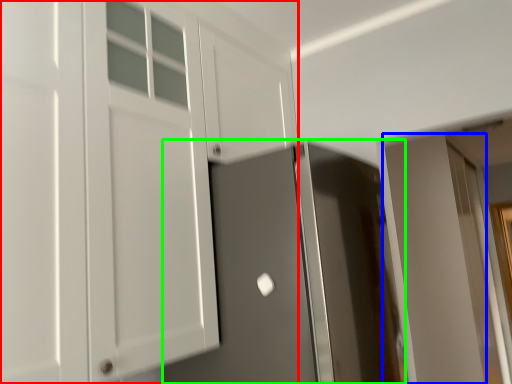
Question: Which object is the farthest from cabinetry (highlighted by a red box)? Choose among these: door (highlighted by a blue box) or door (highlighted by a green box).

Choices:
 (A) door
 (B) door

Answer: (A)